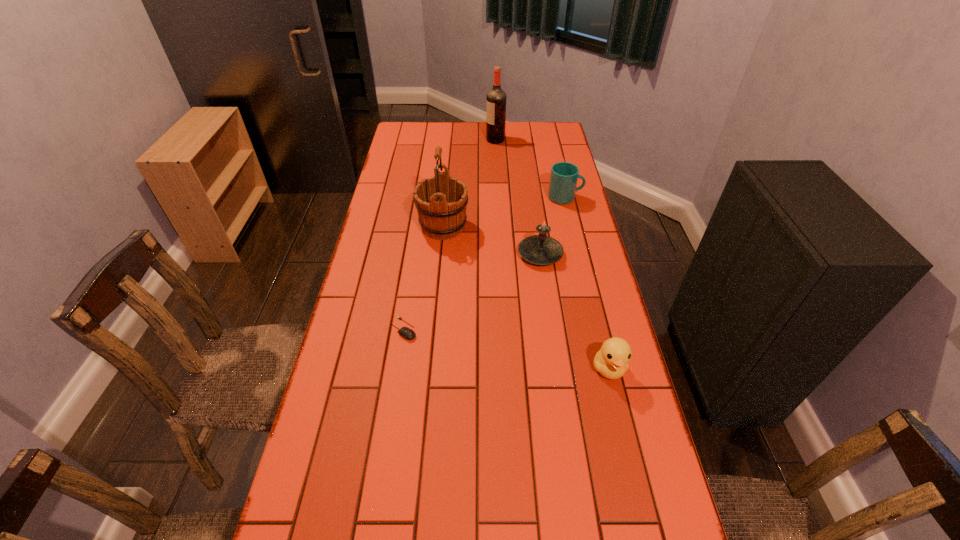
The image size is (960, 540). What are the coordinates of `unoccupied area between the wine bucket and the shortest object` in the screenshot? It's located at (x=423, y=278).

Where is `object that is the closest one to the candle`? object that is the closest one to the candle is located at coordinates (441, 201).

Where is `object that is the second closest to the duck`? This screenshot has height=540, width=960. object that is the second closest to the duck is located at coordinates (405, 332).

Identify the location of free region that satisfies the following two spatial constraints: 1. on the front-facing side of the fourth object from right to left; 2. on the left side of the candle. (501, 254).

Locate an element on the screen. vacant space that satisfies the following two spatial constraints: 1. on the front-facing side of the farthest object; 2. on the front side of the wine bucket is located at coordinates (500, 226).

Where is `free space that satisfies the following two spatial constraints: 1. on the handle side of the cup; 2. on the front side of the fifth farthest object`? This screenshot has width=960, height=540. free space that satisfies the following two spatial constraints: 1. on the handle side of the cup; 2. on the front side of the fifth farthest object is located at coordinates (596, 329).